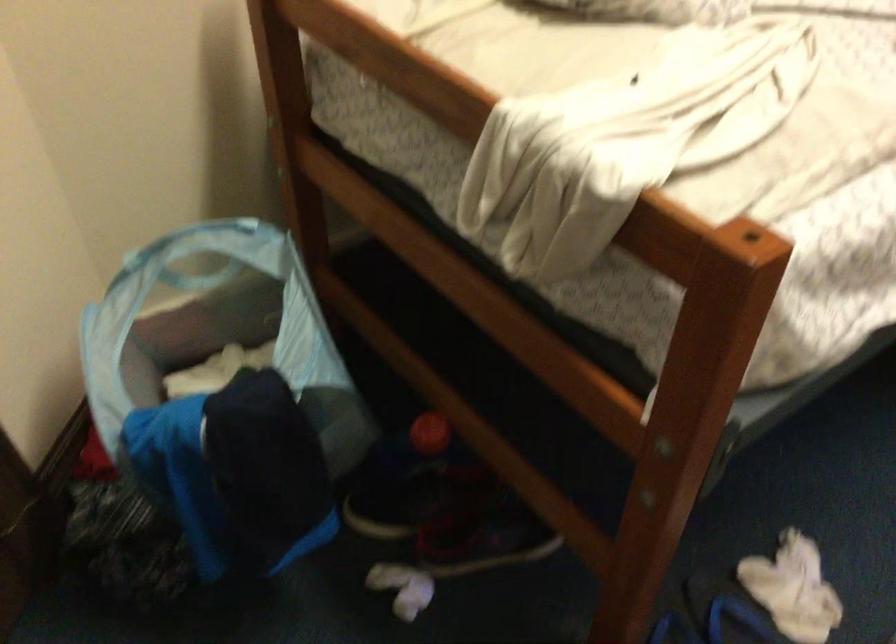
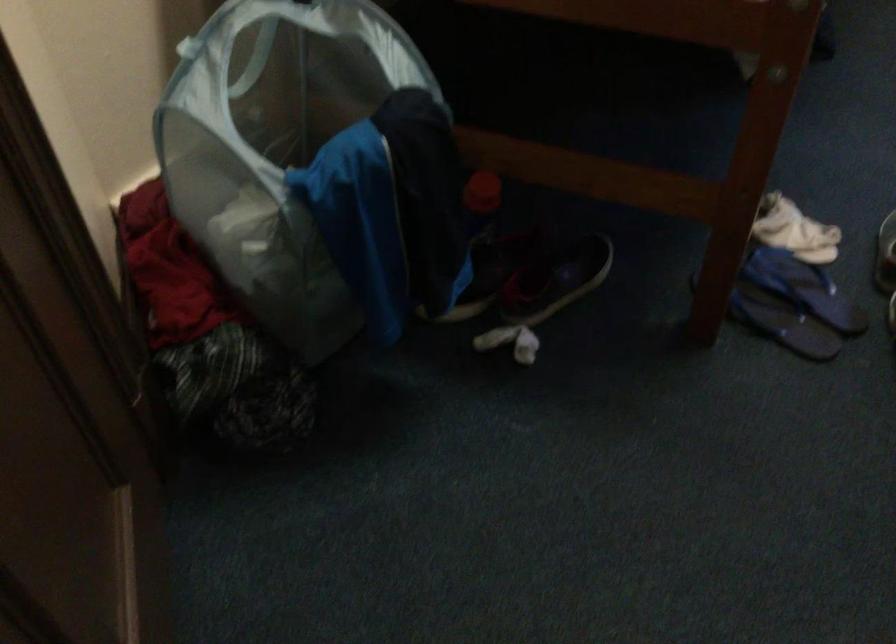
Locate, in the second image, the point that corresponds to point 420,448 in the first image.

(480, 202)